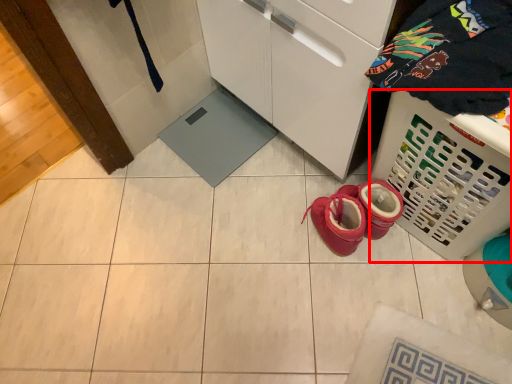
Question: From the image's perspective, where is basket (annotated by the red box) located in relation to clothing in the image?

Choices:
 (A) above
 (B) below

Answer: (B)